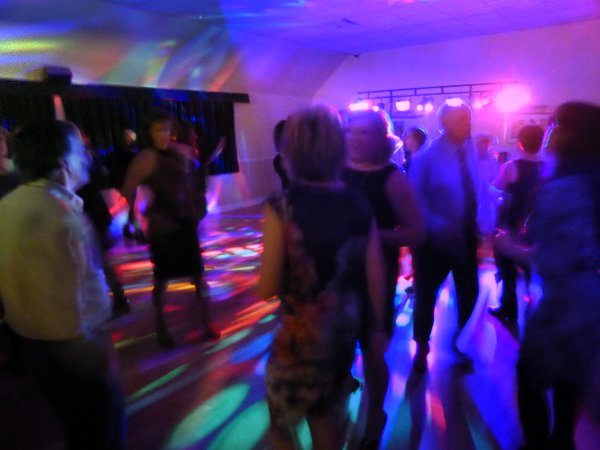
The height and width of the screenshot is (450, 600). Find the location of `ceiling`. ceiling is located at coordinates pyautogui.click(x=395, y=3), pyautogui.click(x=350, y=308).